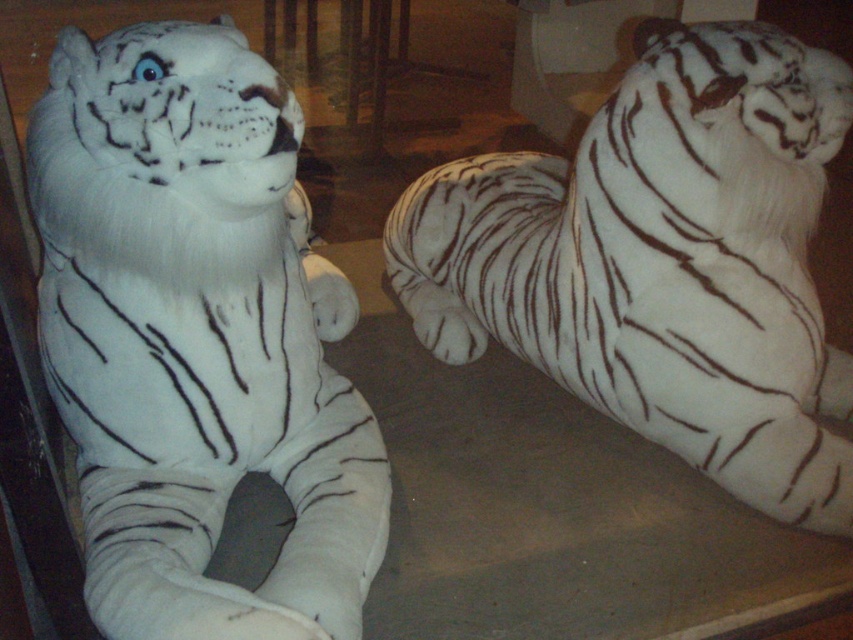
Consider the image. You are organizing a display of toys and need to place a new toy between the white plush tiger at left and another object. Where should you position the new toy to ensure it is centered between them?

The white plush tiger at left is located at point (196,337). To center the new toy between them, calculate the midpoint between their coordinates and place it there.